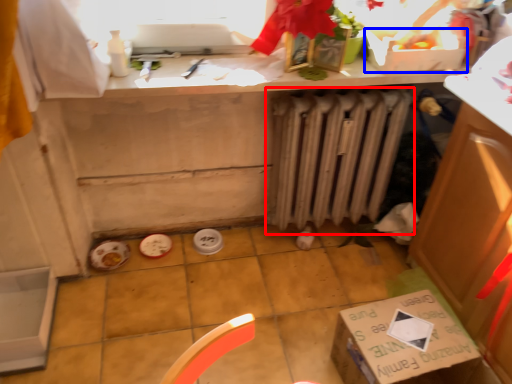
Question: Among these objects, which one is nearest to the camera, radiator (highlighted by a red box) or box (highlighted by a blue box)?

Choices:
 (A) radiator
 (B) box

Answer: (B)